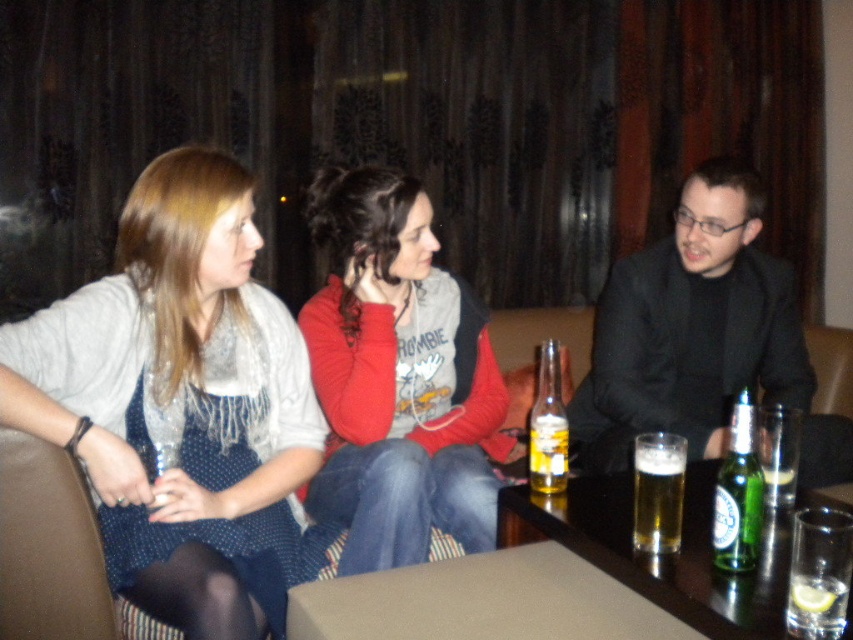
Question: Among these points, which one is nearest to the camera?

Choices:
 (A) (194, 326)
 (B) (659, 449)

Answer: (B)

Question: Which of the following is the closest to the observer?

Choices:
 (A) (734, 512)
 (B) (764, 468)

Answer: (A)

Question: Does red hoodie at center have a lesser width compared to green glass bottle at center?

Choices:
 (A) no
 (B) yes

Answer: (A)

Question: Does red hoodie at center appear under green glass bottle at lower right?

Choices:
 (A) no
 (B) yes

Answer: (A)

Question: Can you confirm if translucent glass bottle at center is positioned below green glass bottle at center?

Choices:
 (A) no
 (B) yes

Answer: (A)

Question: Among these objects, which one is nearest to the camera?

Choices:
 (A) green glass bottle at center
 (B) translucent glass beer bottle at center
 (C) red hoodie at center

Answer: (A)